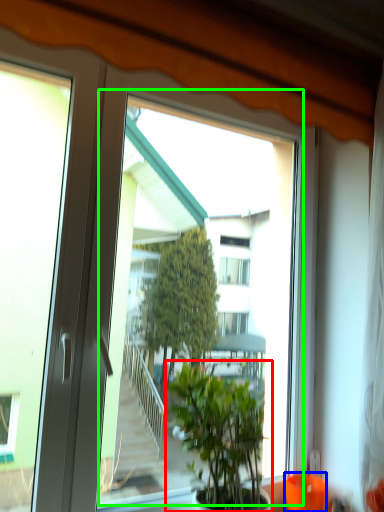
Question: Which object is the farthest from houseplant (highlighted by a red box)? Choose among these: glass vase (highlighted by a blue box) or window screen (highlighted by a green box).

Choices:
 (A) glass vase
 (B) window screen

Answer: (A)